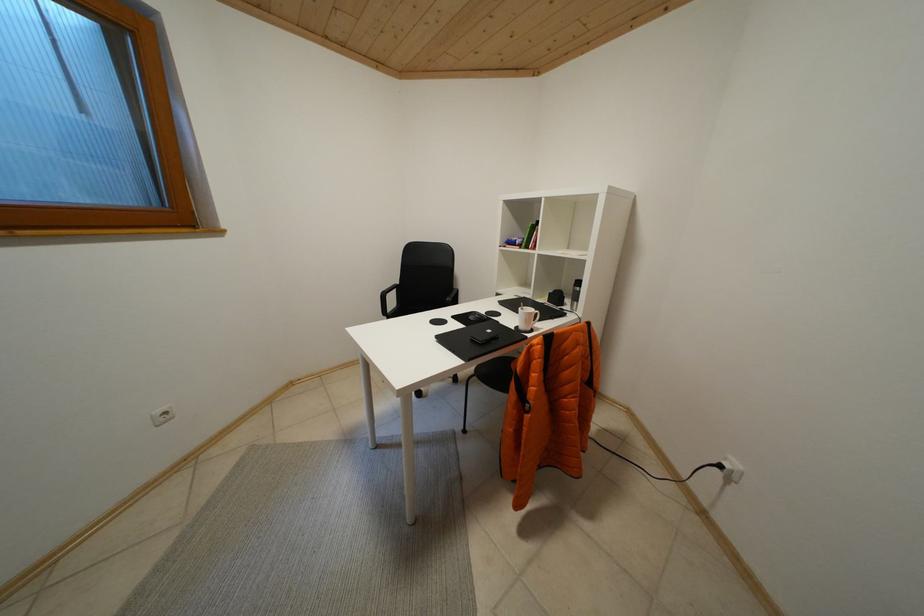
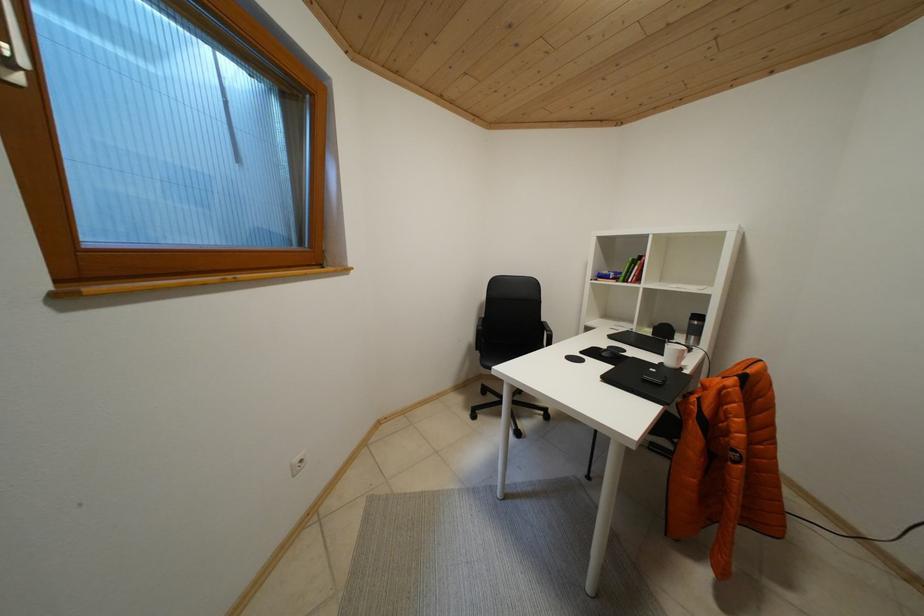
Question: Based on the continuous images, in which direction is the camera rotating? Reply with the corresponding letter.

Choices:
 (A) Left
 (B) Right
 (C) Up
 (D) Down

Answer: (C)